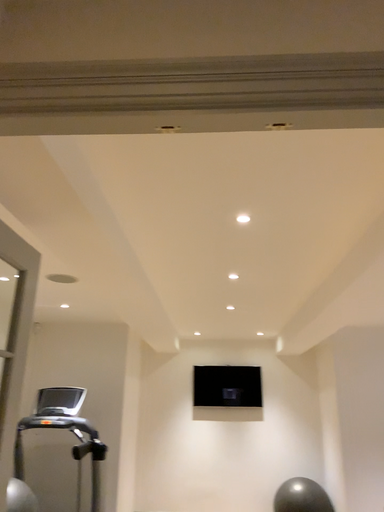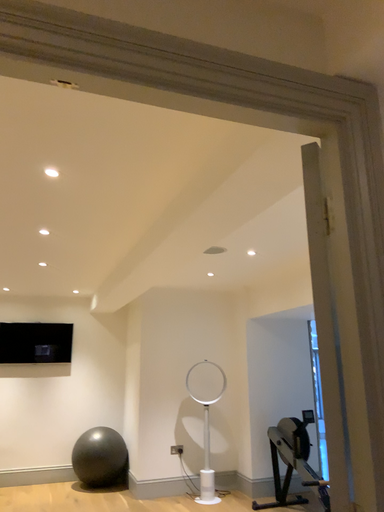
Question: Which way did the camera rotate in the video?

Choices:
 (A) rotated right
 (B) rotated left

Answer: (A)